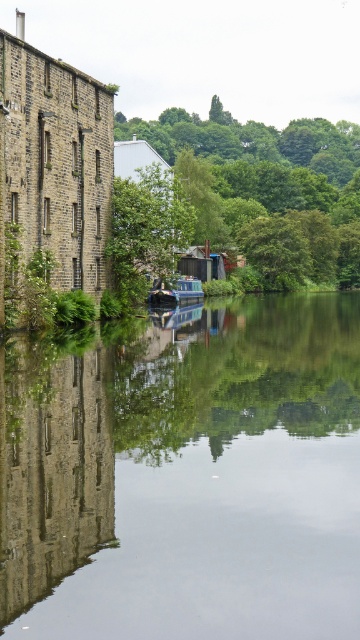
Question: Which of the following is the closest to the observer?

Choices:
 (A) green leafy tree at center
 (B) green leafy tree at upper center
 (C) blue glossy canal boat at center

Answer: (A)

Question: Does smooth reflective water at center have a lesser width compared to green leafy tree at upper center?

Choices:
 (A) no
 (B) yes

Answer: (B)

Question: Is green leafy tree at upper center below blue glossy canal boat at center?

Choices:
 (A) no
 (B) yes

Answer: (A)

Question: Estimate the real-world distances between objects in this image. Which object is farther from the smooth reflective water at center?

Choices:
 (A) green leafy tree at upper center
 (B) blue glossy canal boat at center
 (C) green leafy tree at center

Answer: (A)

Question: Considering the real-world distances, which object is closest to the green leafy tree at upper center?

Choices:
 (A) green leafy tree at center
 (B) smooth reflective water at center

Answer: (A)

Question: Does green leafy tree at upper center have a smaller size compared to blue glossy canal boat at center?

Choices:
 (A) yes
 (B) no

Answer: (B)